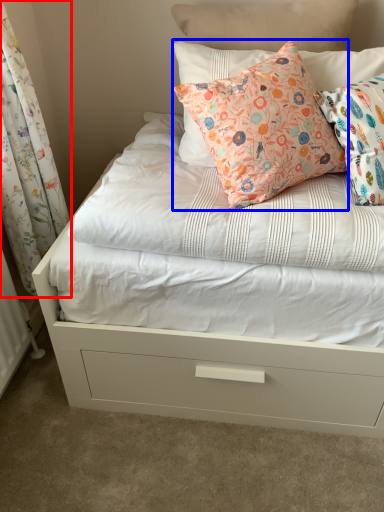
Question: Which object is closer to the camera taking this photo, curtain (highlighted by a red box) or pillow (highlighted by a blue box)?

Choices:
 (A) curtain
 (B) pillow

Answer: (A)